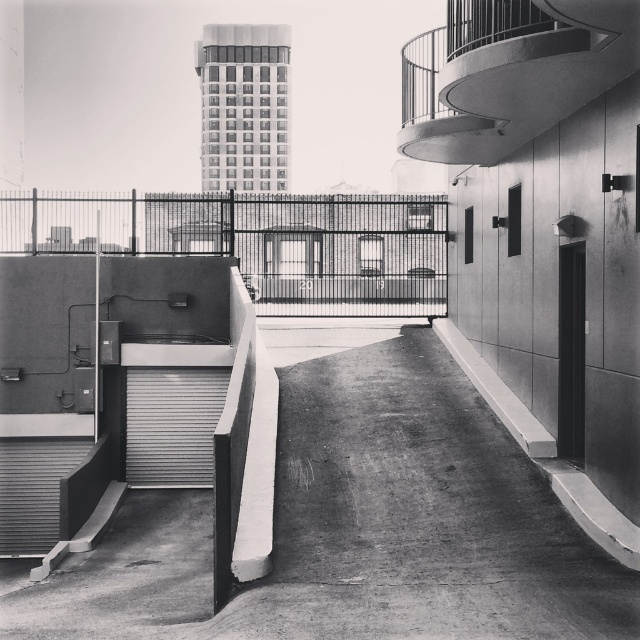
Can you confirm if metallic spiral staircase at upper right is smaller than metallic gray stairwell at lower left?

Yes, metallic spiral staircase at upper right is smaller than metallic gray stairwell at lower left.

Is metallic spiral staircase at upper right wider than metallic gray stairwell at lower left?

Incorrect, metallic spiral staircase at upper right's width does not surpass metallic gray stairwell at lower left's.

The width and height of the screenshot is (640, 640). In order to click on metallic spiral staircase at upper right in this screenshot , I will do `click(509, 72)`.

The width and height of the screenshot is (640, 640). What are the coordinates of `metallic spiral staircase at upper right` in the screenshot? It's located at (509, 72).

Who is positioned more to the left, metallic spiral staircase at upper right or metallic silver door at lower left?

metallic silver door at lower left is more to the left.

This screenshot has height=640, width=640. I want to click on metallic spiral staircase at upper right, so click(x=509, y=72).

The width and height of the screenshot is (640, 640). In order to click on metallic spiral staircase at upper right in this screenshot , I will do `click(509, 72)`.

Does metallic silver door at lower left appear on the right side of metallic gray stairwell at lower left?

Correct, you'll find metallic silver door at lower left to the right of metallic gray stairwell at lower left.

What do you see at coordinates (172, 424) in the screenshot?
I see `metallic silver door at lower left` at bounding box center [172, 424].

Image resolution: width=640 pixels, height=640 pixels. Identify the location of metallic silver door at lower left. (172, 424).